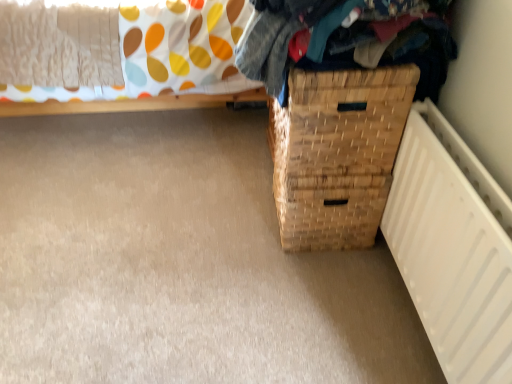
Question: Would you say woven fabric clothes at upper right is part of white matte radiator at lower right's contents?

Choices:
 (A) no
 (B) yes

Answer: (A)

Question: From the image's perspective, is white matte radiator at lower right located beneath woven fabric clothes at upper right?

Choices:
 (A) yes
 (B) no

Answer: (A)

Question: Considering the relative positions of white matte radiator at lower right and woven fabric clothes at upper right in the image provided, is white matte radiator at lower right behind woven fabric clothes at upper right?

Choices:
 (A) yes
 (B) no

Answer: (B)

Question: Are white matte radiator at lower right and woven fabric clothes at upper right making contact?

Choices:
 (A) yes
 (B) no

Answer: (B)

Question: Is woven fabric clothes at upper right at the back of white matte radiator at lower right?

Choices:
 (A) no
 (B) yes

Answer: (A)

Question: Is woven wood basket at lower right in front of or behind woven wood basket at lower right in the image?

Choices:
 (A) front
 (B) behind

Answer: (A)

Question: Is point (327, 87) positioned closer to the camera than point (32, 21)?

Choices:
 (A) farther
 (B) closer

Answer: (B)

Question: In terms of height, does woven wood basket at lower right look taller or shorter compared to woven wood basket at lower right?

Choices:
 (A) short
 (B) tall

Answer: (A)

Question: In the image, is woven wood basket at lower right on the left side or the right side of woven wood basket at lower right?

Choices:
 (A) right
 (B) left

Answer: (A)

Question: Choose the correct answer: Is white matte radiator at lower right inside woven wood basket at lower right or outside it?

Choices:
 (A) outside
 (B) inside

Answer: (A)

Question: Is white matte radiator at lower right wider or thinner than woven wood basket at lower right?

Choices:
 (A) wide
 (B) thin

Answer: (B)

Question: Does point (445, 268) appear closer or farther from the camera than point (332, 246)?

Choices:
 (A) closer
 (B) farther

Answer: (A)

Question: Is white matte radiator at lower right taller or shorter than woven wood basket at lower right?

Choices:
 (A) short
 (B) tall

Answer: (B)

Question: From their relative heights in the image, would you say woven wood basket at lower right is taller or shorter than white matte radiator at lower right?

Choices:
 (A) tall
 (B) short

Answer: (A)

Question: Based on their positions, is woven wood basket at lower right located to the left or right of white matte radiator at lower right?

Choices:
 (A) right
 (B) left

Answer: (B)